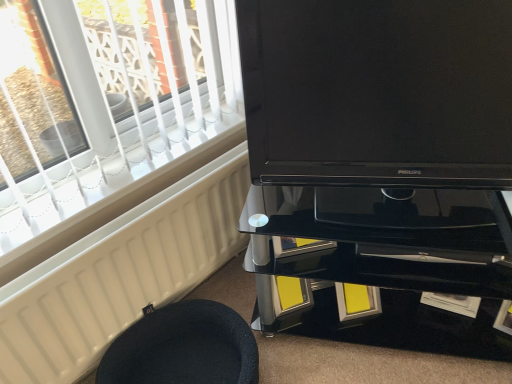
Question: Is black fabric stool at lower left not within black glass tv cabinet at center?

Choices:
 (A) no
 (B) yes

Answer: (B)

Question: From a real-world perspective, is black fabric stool at lower left over black glass tv cabinet at center?

Choices:
 (A) no
 (B) yes

Answer: (A)

Question: Is black fabric stool at lower left next to black glass tv cabinet at center?

Choices:
 (A) no
 (B) yes

Answer: (A)

Question: From the image's perspective, would you say black fabric stool at lower left is shown under black glass tv cabinet at center?

Choices:
 (A) yes
 (B) no

Answer: (A)

Question: From the image's perspective, is black fabric stool at lower left above black glass tv cabinet at center?

Choices:
 (A) yes
 (B) no

Answer: (B)

Question: Considering the positions of point (471, 122) and point (193, 261), is point (471, 122) closer or farther from the camera than point (193, 261)?

Choices:
 (A) farther
 (B) closer

Answer: (B)

Question: Is matte black tv at center inside the boundaries of white matte radiator at lower left, or outside?

Choices:
 (A) inside
 (B) outside

Answer: (B)

Question: From the image's perspective, relative to white matte radiator at lower left, is matte black tv at center above or below?

Choices:
 (A) below
 (B) above

Answer: (B)

Question: Considering the relative positions of matte black tv at center and white matte radiator at lower left in the image provided, is matte black tv at center to the left or to the right of white matte radiator at lower left?

Choices:
 (A) right
 (B) left

Answer: (A)

Question: Considering the positions of matte black tv at center and black glass tv cabinet at center in the image, is matte black tv at center wider or thinner than black glass tv cabinet at center?

Choices:
 (A) thin
 (B) wide

Answer: (A)

Question: Based on their positions, is matte black tv at center located to the left or right of black glass tv cabinet at center?

Choices:
 (A) left
 (B) right

Answer: (A)

Question: Is point click(x=285, y=182) positioned closer to the camera than point click(x=358, y=334)?

Choices:
 (A) farther
 (B) closer

Answer: (B)

Question: In terms of size, does matte black tv at center appear bigger or smaller than black glass tv cabinet at center?

Choices:
 (A) big
 (B) small

Answer: (B)

Question: Considering the positions of white matte radiator at lower left and black fabric stool at lower left in the image, is white matte radiator at lower left taller or shorter than black fabric stool at lower left?

Choices:
 (A) short
 (B) tall

Answer: (B)

Question: From a real-world perspective, is white matte radiator at lower left above or below black fabric stool at lower left?

Choices:
 (A) below
 (B) above

Answer: (B)